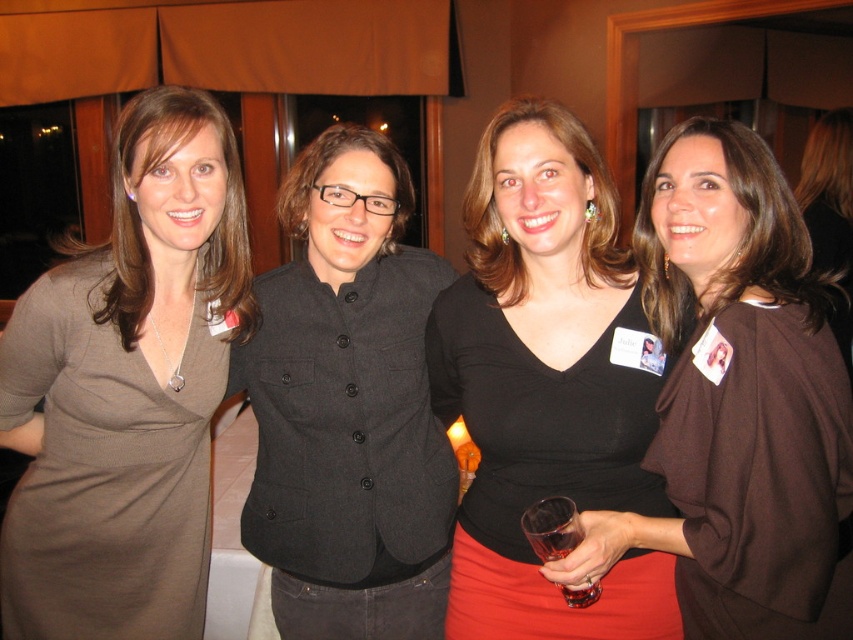
Is black matte dress at center positioned in front of charcoal wool blazer at center?

Yes, it is in front of charcoal wool blazer at center.

Which is more to the right, black matte dress at center or charcoal wool blazer at center?

black matte dress at center

Is point (677, 636) farther from viewer compared to point (280, 275)?

No, it is not.

This screenshot has width=853, height=640. In order to click on black matte dress at center in this screenshot , I will do `click(547, 384)`.

Find the location of a particular element. Image resolution: width=853 pixels, height=640 pixels. brown matte dress at center is located at coordinates (738, 401).

Is point (701, 230) less distant than point (845, 294)?

Yes.

Where is `brown matte dress at center`? This screenshot has height=640, width=853. brown matte dress at center is located at coordinates (738, 401).

Can you confirm if black matte dress at center is smaller than transparent glass at lower center?

No.

Between black matte dress at center and transparent glass at lower center, which one appears on the right side from the viewer's perspective?

From the viewer's perspective, transparent glass at lower center appears more on the right side.

Image resolution: width=853 pixels, height=640 pixels. Find the location of `black matte dress at center`. black matte dress at center is located at coordinates (547, 384).